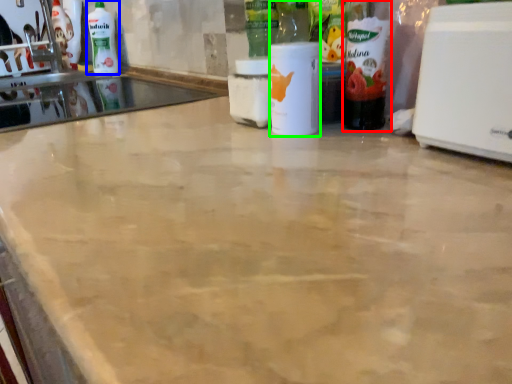
Question: Based on their relative distances, which object is farther from bottle (highlighted by a red box)? Choose from cleaning product (highlighted by a blue box) and bottle (highlighted by a green box).

Choices:
 (A) cleaning product
 (B) bottle

Answer: (A)